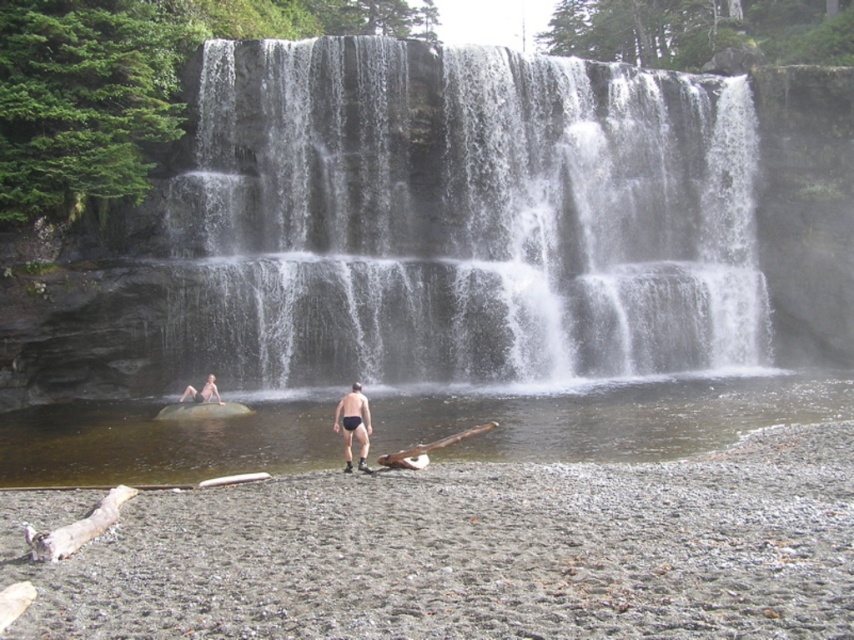
Which is below, nude matte swim trunks at center or brown wood log at center?

brown wood log at center is lower down.

Who is positioned more to the right, nude matte swim trunks at center or brown wood log at center?

From the viewer's perspective, brown wood log at center appears more on the right side.

Which is behind, point (366, 404) or point (413, 448)?

The point (413, 448) is behind.

Where is `nude matte swim trunks at center`? Image resolution: width=854 pixels, height=640 pixels. nude matte swim trunks at center is located at coordinates (354, 424).

Is white textured water at center smaller than smooth skin person at lower left?

No, white textured water at center is not smaller than smooth skin person at lower left.

Consider the image. Is white textured water at center shorter than smooth skin person at lower left?

Incorrect, white textured water at center's height does not fall short of smooth skin person at lower left's.

Is point (437, 170) closer to camera compared to point (212, 392)?

No.

Where is `white textured water at center`? white textured water at center is located at coordinates (461, 221).

Which is behind, point (393, 408) or point (396, 464)?

The point (393, 408) is behind.

Who is positioned more to the left, clear water at lower center or brown wood log at center?

brown wood log at center

Who is more distant from viewer, (412, 419) or (472, 432)?

Point (412, 419)

Where is `clear water at lower center`? clear water at lower center is located at coordinates (611, 417).